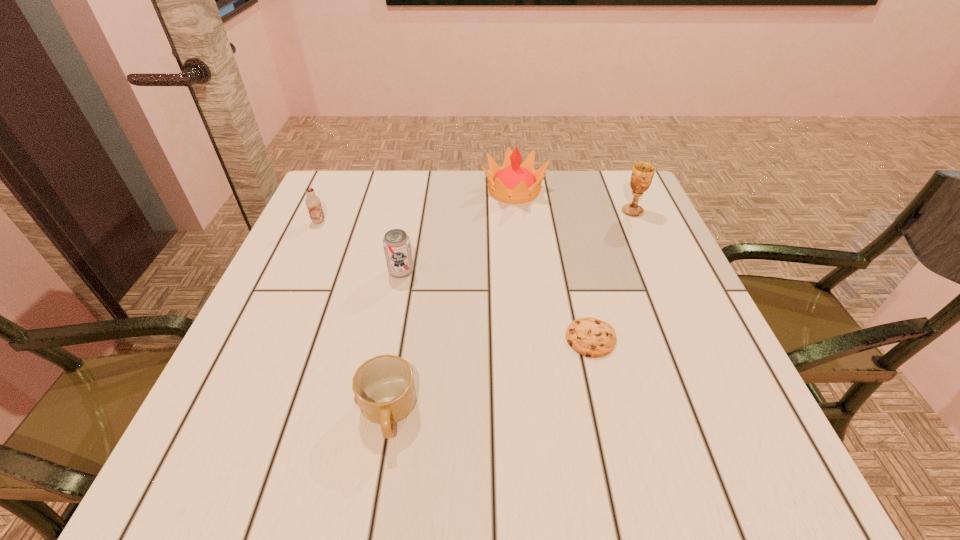
Locate an element on the screen. The height and width of the screenshot is (540, 960). free point between the rightmost object and the second nearest object is located at coordinates (612, 275).

Where is `free point between the rightmost object and the fourth nearest object`? This screenshot has width=960, height=540. free point between the rightmost object and the fourth nearest object is located at coordinates (475, 217).

You are a GUI agent. You are given a task and a screenshot of the screen. Output one action in this format:
    pyautogui.click(x=<x>, y=<y>)
    Task: Click on the vacant space that is in between the nearest object and the leftmost object
    The image size is (960, 540).
    Given the screenshot: What is the action you would take?
    pyautogui.click(x=353, y=317)

The height and width of the screenshot is (540, 960). In order to click on vacant area that lies between the third nearest object and the nearest object in this screenshot , I will do `click(395, 342)`.

This screenshot has width=960, height=540. Find the location of `free space between the chalice and the fifth farthest object`. free space between the chalice and the fifth farthest object is located at coordinates (612, 275).

Find the location of `empty space between the crown and the second nearest object`. empty space between the crown and the second nearest object is located at coordinates (552, 264).

The width and height of the screenshot is (960, 540). I want to click on unoccupied position between the chocolate milk and the crown, so click(x=417, y=206).

The height and width of the screenshot is (540, 960). In order to click on object that is the fifth nearest to the fifth farthest object in this screenshot , I will do `click(313, 203)`.

Point out which object is positioned as the second nearest to the third nearest object. Please provide its 2D coordinates. Your answer should be formatted as a tuple, i.e. [(x, y)], where the tuple contains the x and y coordinates of a point satisfying the conditions above.

[(384, 388)]

Find the location of a particular element. Image resolution: width=960 pixels, height=540 pixels. free space in the image that satisfies the following two spatial constraints: 1. on the front side of the crown; 2. on the left side of the cookie is located at coordinates (530, 338).